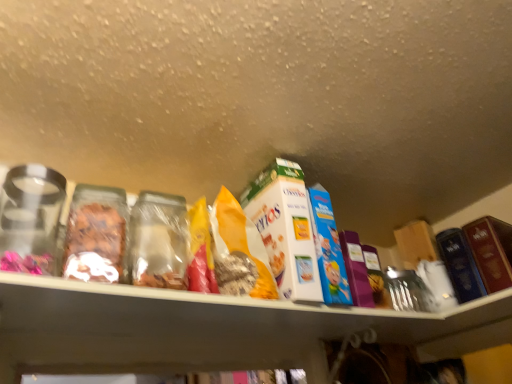
Question: Do you think hardcover book at right, marked as the 1th product in a right-to-left arrangement, is within white cardboard cereal box at center, which appears as the 2th product when viewed from the right, or outside of it?

Choices:
 (A) inside
 (B) outside

Answer: (B)

Question: Based on their positions, is hardcover book at right, marked as the 1th product in a right-to-left arrangement, located to the left or right of white cardboard cereal box at center, which appears as the 2th product when viewed from the right?

Choices:
 (A) left
 (B) right

Answer: (B)

Question: Which object is the farthest from the hardcover book at right, marked as the 1th product in a right-to-left arrangement?

Choices:
 (A) yellow paper bag at center
 (B) white cardboard cereal box at center, which appears as the 2th product when viewed from the right

Answer: (A)

Question: Considering the real-world distances, which object is farthest from the yellow paper bag at center?

Choices:
 (A) hardcover book at right, marked as the 1th product in a right-to-left arrangement
 (B) white cardboard cereal box at center, which appears as the 2th product when viewed from the right

Answer: (A)